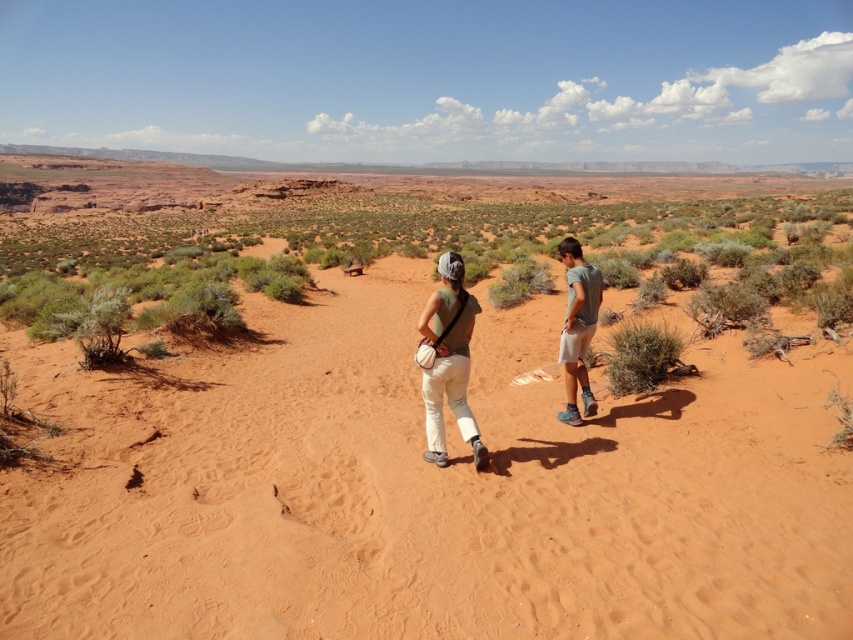
The height and width of the screenshot is (640, 853). Find the location of `white cotton pants at center`. white cotton pants at center is located at coordinates (448, 360).

Which is below, white cotton pants at center or green shrub at center?

green shrub at center is lower down.

The image size is (853, 640). Find the location of `white cotton pants at center`. white cotton pants at center is located at coordinates (448, 360).

Does point (701, 536) come farther from viewer compared to point (664, 362)?

No.

Does dusty sand at center have a greater width compared to green shrub at center?

Yes.

Measure the distance between point [599,374] and camera.

Point [599,374] is 27.90 feet away from camera.

Identify the location of dusty sand at center. The width and height of the screenshot is (853, 640). (421, 490).

Does dusty sand at center have a lesser height compared to white cotton shorts at right?

In fact, dusty sand at center may be taller than white cotton shorts at right.

Is dusty sand at center thinner than white cotton shorts at right?

In fact, dusty sand at center might be wider than white cotton shorts at right.

Does point (830, 493) come behind point (561, 360)?

That is False.

I want to click on dusty sand at center, so click(x=421, y=490).